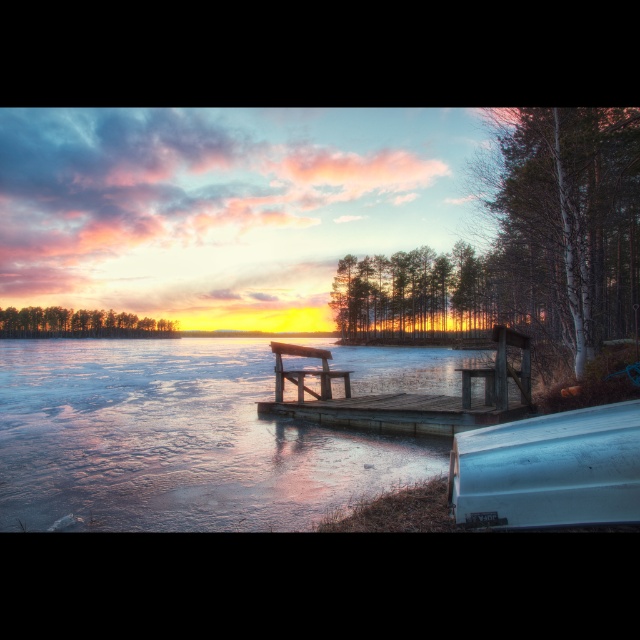
Is white matte boat at lower right positioned behind wooden bench at center?

No, it is in front of wooden bench at center.

Is point (579, 442) positioned before point (323, 388)?

Yes.

Measure the distance between white matte boat at lower right and camera.

white matte boat at lower right and camera are 3.19 meters apart.

In order to click on white matte boat at lower right in this screenshot , I will do `click(548, 468)`.

Can you confirm if transparent ice at center is thinner than wooden dock at center?

In fact, transparent ice at center might be wider than wooden dock at center.

Is transparent ice at center closer to camera compared to wooden dock at center?

Yes, it is in front of wooden dock at center.

The image size is (640, 640). What are the coordinates of `transparent ice at center` in the screenshot? It's located at (177, 440).

Is white matte boat at lower right bigger than wooden dock at center?

Incorrect, white matte boat at lower right is not larger than wooden dock at center.

Does white matte boat at lower right appear over wooden dock at center?

No, white matte boat at lower right is not above wooden dock at center.

Is point (548, 484) farther from camera compared to point (506, 390)?

No, it is not.

Where is `white matte boat at lower right`? The image size is (640, 640). white matte boat at lower right is located at coordinates (548, 468).